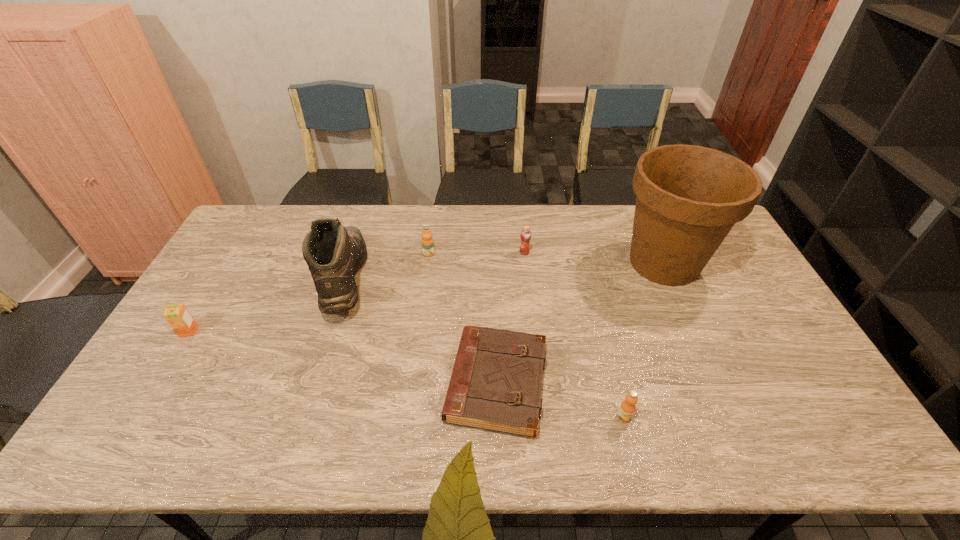
Where is `the tallest object`? Image resolution: width=960 pixels, height=540 pixels. the tallest object is located at coordinates coord(689,197).

Locate an element on the screen. This screenshot has height=540, width=960. the rightmost object is located at coordinates (689, 197).

This screenshot has width=960, height=540. What are the coordinates of `the second object from left to right` in the screenshot? It's located at (x=334, y=253).

Find the location of a particular element. the sixth shortest object is located at coordinates (334, 253).

What are the coordinates of `the third orange juice from right to left` in the screenshot? It's located at (427, 236).

The image size is (960, 540). What are the coordinates of `the second orange juice from right to left` in the screenshot? It's located at (525, 235).

Where is `the leftmost orange juice`? This screenshot has height=540, width=960. the leftmost orange juice is located at coordinates (178, 316).

Where is `the leftmost object`? Image resolution: width=960 pixels, height=540 pixels. the leftmost object is located at coordinates (178, 316).

I want to click on the second object from right to left, so click(x=626, y=411).

Find the location of a particular element. This screenshot has height=540, width=960. the nearest orange juice is located at coordinates (626, 411).